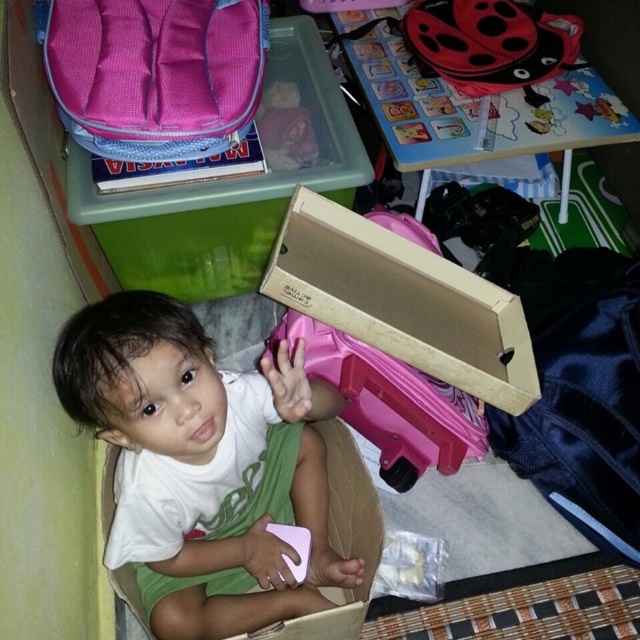
You are a parent trying to reach your child who is sitting inside a cardboard box. You want to hand them a snack. Based on the distance provided, can you estimate if you can comfortably reach the white matte toddler at center from where you are standing?

The white matte toddler at center is 76.39 centimeters away from the viewer. Since the average adult arm length is around 65 to 70 centimeters, you may need to take a step forward to comfortably reach the white matte toddler at center.

You are a parent trying to locate your child in a cluttered room. You see the white matte toddler at center and the pink plastic suitcase at center. Which object is nearer to you?

The white matte toddler at center is closer to the viewer than the pink plastic suitcase at center, so the toddler is nearer.

What are the coordinates of the white matte toddler at center?

The white matte toddler at center is located at point (202, 465).